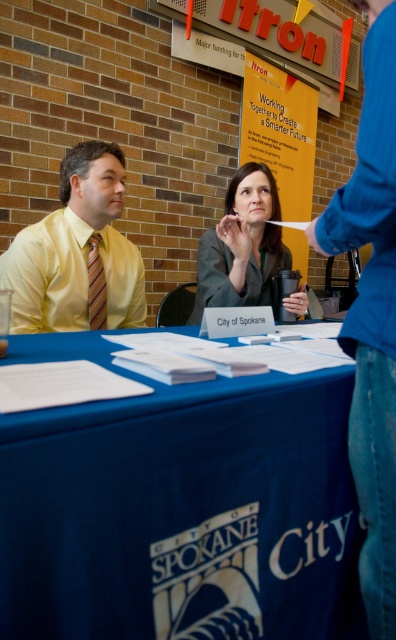
Who is more forward, [354,227] or [257,269]?

Point [354,227] is more forward.

How much distance is there between yellow dress shirt at center and matte gray suit at center?

A distance of 31.26 inches exists between yellow dress shirt at center and matte gray suit at center.

Is point (392, 138) positioned after point (213, 284)?

That is False.

The height and width of the screenshot is (640, 396). Identify the location of yellow dress shirt at center. (371, 312).

Which is above, yellow satin shirt at left or matte gray suit at center?

matte gray suit at center

Looking at this image, who is more distant from viewer, (83, 276) or (234, 280)?

Point (234, 280)

This screenshot has width=396, height=640. In order to click on yellow satin shirt at left in this screenshot , I will do `click(78, 253)`.

Is blue fabric table at center positioned behind matte gray suit at center?

No.

Looking at this image, does blue fabric table at center have a larger size compared to matte gray suit at center?

Indeed, blue fabric table at center has a larger size compared to matte gray suit at center.

Identify the location of blue fabric table at center. The width and height of the screenshot is (396, 640). (180, 508).